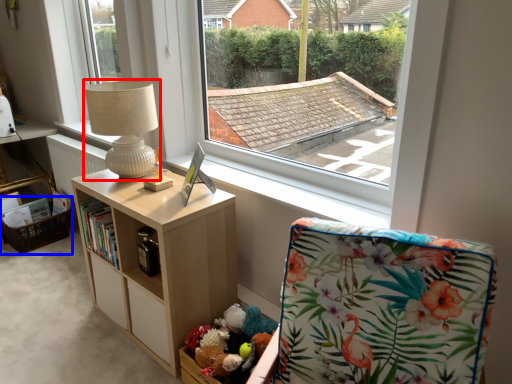
Question: Which object is closer to the camera taking this photo, table lamp (highlighted by a red box) or basket (highlighted by a blue box)?

Choices:
 (A) table lamp
 (B) basket

Answer: (A)